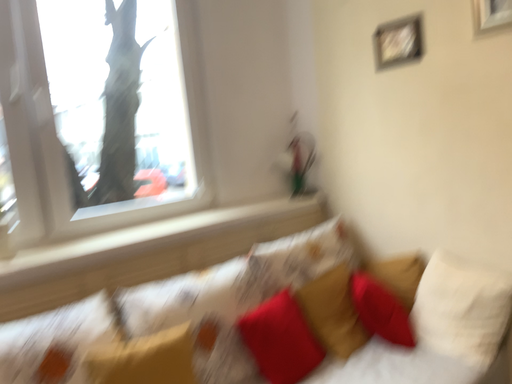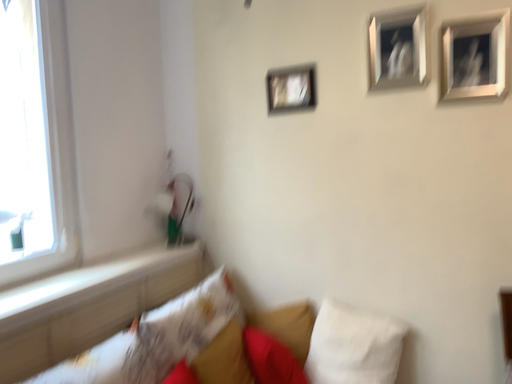
Question: How did the camera likely rotate when shooting the video?

Choices:
 (A) rotated left
 (B) rotated right

Answer: (B)